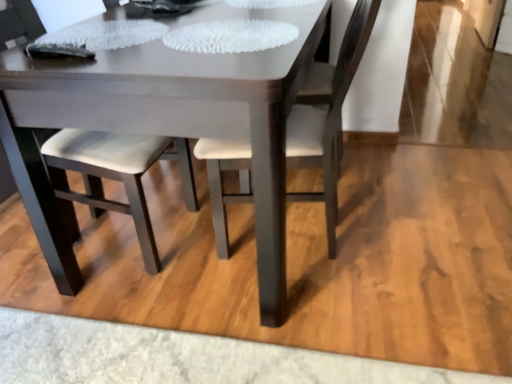
Question: Is matte white chair at center, placed as the 1th chair when sorted from left to right, further to the viewer compared to white leather chair at center, which is the 2th chair in left-to-right order?

Choices:
 (A) yes
 (B) no

Answer: (B)

Question: From a real-world perspective, is matte white chair at center, which appears as the 2th chair when viewed from the right, located higher than white leather chair at center, which is the 2th chair in left-to-right order?

Choices:
 (A) yes
 (B) no

Answer: (A)

Question: Can you confirm if matte white chair at center, which appears as the 2th chair when viewed from the right, is positioned to the left of white leather chair at center, placed as the first chair when sorted from right to left?

Choices:
 (A) no
 (B) yes

Answer: (B)

Question: Is matte white chair at center, placed as the 1th chair when sorted from left to right, to the right of white leather chair at center, which is the 2th chair in left-to-right order, from the viewer's perspective?

Choices:
 (A) yes
 (B) no

Answer: (B)

Question: Does matte white chair at center, which appears as the 2th chair when viewed from the right, have a greater width compared to white leather chair at center, placed as the first chair when sorted from right to left?

Choices:
 (A) yes
 (B) no

Answer: (B)

Question: Does matte white chair at center, placed as the 1th chair when sorted from left to right, have a lesser width compared to white leather chair at center, which is the 2th chair in left-to-right order?

Choices:
 (A) no
 (B) yes

Answer: (B)

Question: From a real-world perspective, is matte white chair at center, which appears as the 2th chair when viewed from the right, positioned under matte white table at center based on gravity?

Choices:
 (A) no
 (B) yes

Answer: (A)

Question: Would you say matte white chair at center, which appears as the 2th chair when viewed from the right, contains matte white table at center?

Choices:
 (A) yes
 (B) no

Answer: (B)

Question: From the image's perspective, is matte white chair at center, placed as the 1th chair when sorted from left to right, below matte white table at center?

Choices:
 (A) yes
 (B) no

Answer: (A)

Question: Could you tell me if matte white chair at center, placed as the 1th chair when sorted from left to right, is turned towards matte white table at center?

Choices:
 (A) yes
 (B) no

Answer: (A)

Question: Does matte white chair at center, placed as the 1th chair when sorted from left to right, lie behind matte white table at center?

Choices:
 (A) yes
 (B) no

Answer: (A)

Question: Is there a large distance between matte white chair at center, placed as the 1th chair when sorted from left to right, and matte white table at center?

Choices:
 (A) yes
 (B) no

Answer: (B)

Question: Would you say matte white table at center is part of white leather chair at center, placed as the first chair when sorted from right to left,'s contents?

Choices:
 (A) yes
 (B) no

Answer: (B)